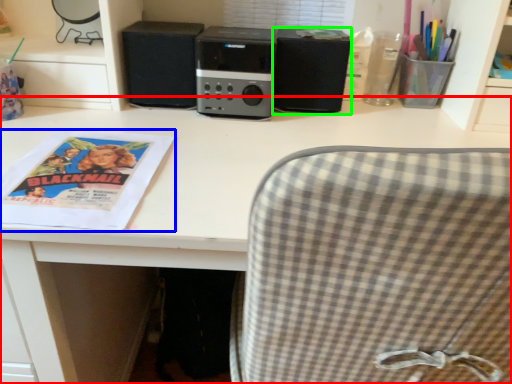
Question: Which is farther away from desk (highlighted by a red box)? magazine (highlighted by a blue box) or speaker (highlighted by a green box)?

Choices:
 (A) magazine
 (B) speaker

Answer: (B)